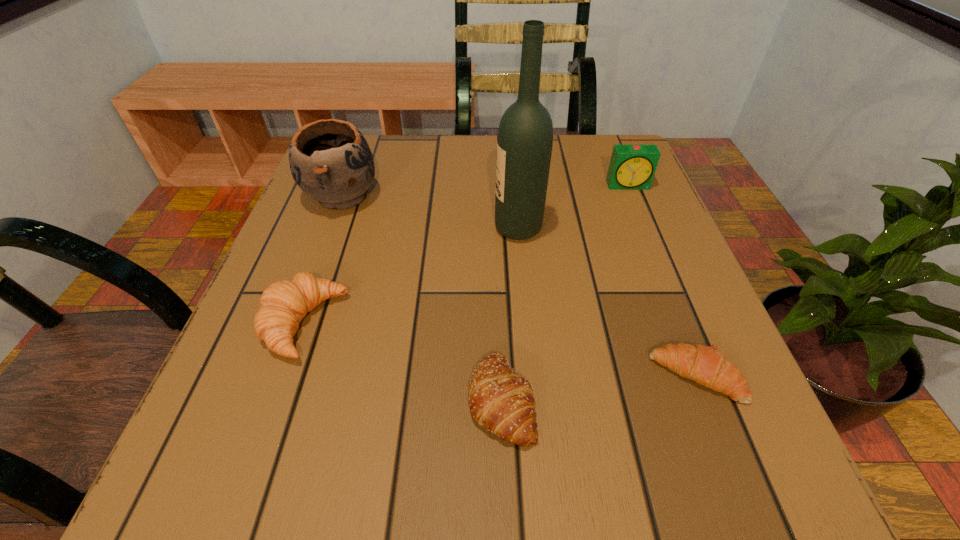
Locate an element on the screen. The width and height of the screenshot is (960, 540). the tallest object is located at coordinates (525, 136).

Where is `the second tallest object`? The image size is (960, 540). the second tallest object is located at coordinates (330, 160).

This screenshot has height=540, width=960. In order to click on the third tallest object in this screenshot , I will do `click(632, 167)`.

Where is `the leftmost crescent roll`? the leftmost crescent roll is located at coordinates (283, 305).

You are a GUI agent. You are given a task and a screenshot of the screen. Output one action in this format:
    pyautogui.click(x=<x>, y=<y>)
    Task: Click on the second crescent roll from right to left
    This screenshot has height=540, width=960.
    Given the screenshot: What is the action you would take?
    pyautogui.click(x=502, y=402)

Locate an element on the screen. The image size is (960, 540). the rightmost crescent roll is located at coordinates (705, 365).

You are a GUI agent. You are given a task and a screenshot of the screen. Output one action in this format:
    pyautogui.click(x=<x>, y=<y>)
    Task: Click on the shortest crescent roll
    This screenshot has width=960, height=540.
    Given the screenshot: What is the action you would take?
    pyautogui.click(x=705, y=365)

Find the location of a particular element. free space located on the labeled side of the tallest object is located at coordinates (300, 228).

Locate an element on the screen. free spot located on the labeled side of the tallest object is located at coordinates (340, 228).

Identify the location of vacant region located 0.170m on the labeled side of the tallest object. (407, 228).